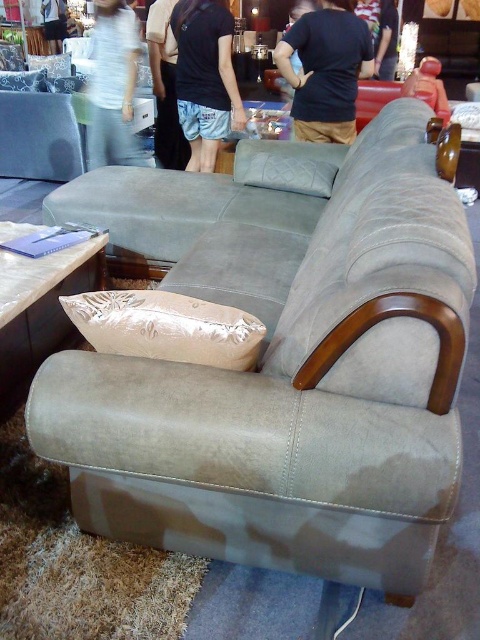
You are a customer in a furniture store and see the satin beige pillow at lower center and the light brown fabric pants at center. You want to place a 2.5 meter long sofa between them. Will there be enough space?

The distance between the satin beige pillow at lower center and the light brown fabric pants at center is 3.72 meters. Since the sofa is 2.5 meters long, there will be sufficient space as 3.72 meters is greater than 2.5 meters.

You are a customer in the showroom and want to sit on the sofa. Where exactly is the satin beige pillow at lower center located on the sofa?

The satin beige pillow at lower center is located at point (x=167, y=326) on the sofa.

You are a customer in the showroom and want to sit on the sofa. You see the satin beige pillow at lower center and the light brown fabric pants at center. Which object is positioned to the right side of the other?

The satin beige pillow at lower center is to the right of the light brown fabric pants at center.